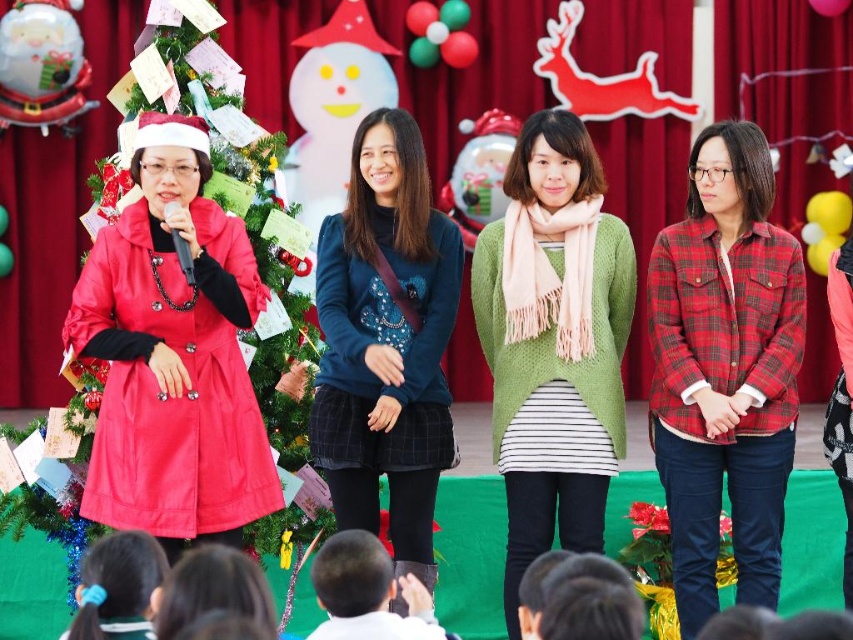
Based on the photo, you are standing at the point marked as point (770, 536) and want to take a photo of the stage. The camera you are using has a maximum range of 40 meters. Will you be able to capture the stage clearly from this position?

The distance between point (770, 536) and the camera is 42.26 meters, which exceeds the camera maximum range of 40 meters. Therefore, you won not be able to capture the stage clearly from this position.